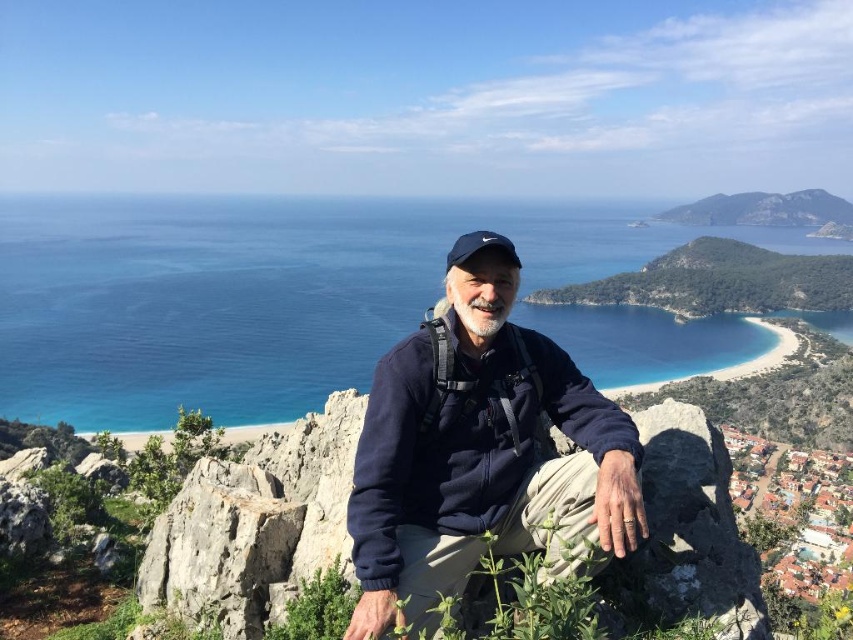
Between point (654, 499) and point (706, 285), which one is positioned in front?

Point (654, 499) is more forward.

Is rugged stone cliff at center taller than green leafy hill at center right?

No, rugged stone cliff at center is not taller than green leafy hill at center right.

Is point (268, 531) positioned behind point (662, 259)?

No, (268, 531) is in front of (662, 259).

Image resolution: width=853 pixels, height=640 pixels. Find the location of `rugged stone cliff at center`. rugged stone cliff at center is located at coordinates (256, 524).

Who is more forward, (718, 577) or (747, 205)?

Positioned in front is point (718, 577).

Does rugged stone cliff at center have a lesser width compared to green leafy hill at upper right?

Correct, rugged stone cliff at center's width is less than green leafy hill at upper right's.

This screenshot has height=640, width=853. What do you see at coordinates (256, 524) in the screenshot?
I see `rugged stone cliff at center` at bounding box center [256, 524].

The image size is (853, 640). What are the coordinates of `rugged stone cliff at center` in the screenshot? It's located at point(256,524).

Can you confirm if navy blue fleece at center is smaller than green leafy hill at upper right?

Indeed, navy blue fleece at center has a smaller size compared to green leafy hill at upper right.

Between point (477, 458) and point (799, 202), which one is positioned in front?

Positioned in front is point (477, 458).

The width and height of the screenshot is (853, 640). I want to click on navy blue fleece at center, so [479, 449].

Identify the location of navy blue fleece at center. (479, 449).